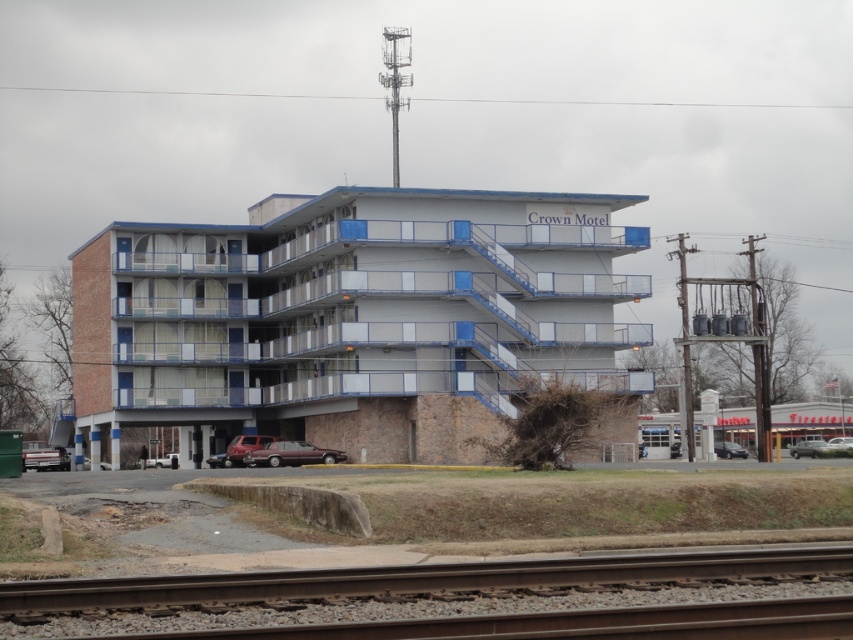
You are a delivery person trying to park your 1.8 meters tall delivery cart between the metallic maroon sedan at center and the dark gray metallic sedan at lower right. Can you fit your cart vertically between them?

The metallic maroon sedan at center is taller than the dark gray metallic sedan at lower right. The height difference means there might be enough vertical space for the 1.8 meters tall delivery cart between them, but since the exact distance between the two sedans isn